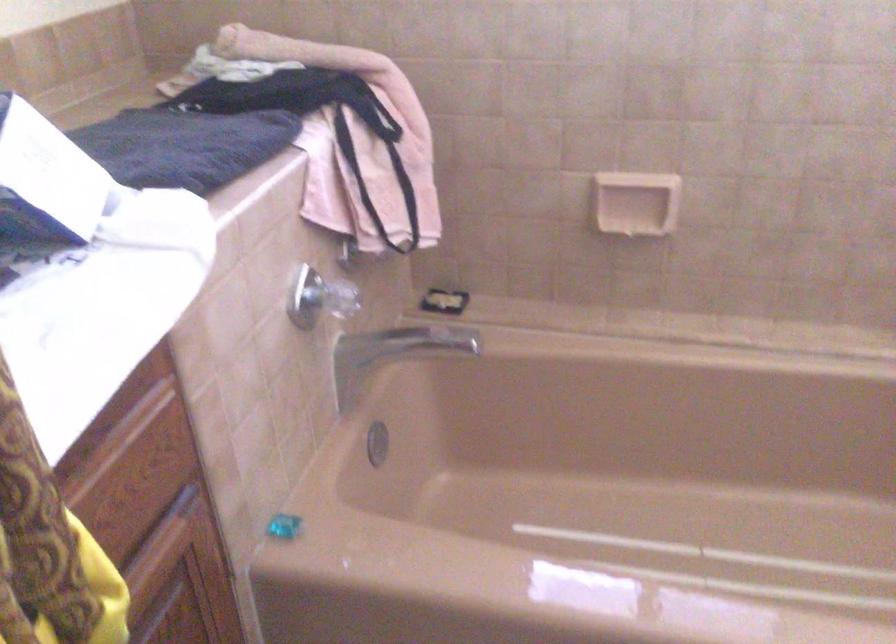
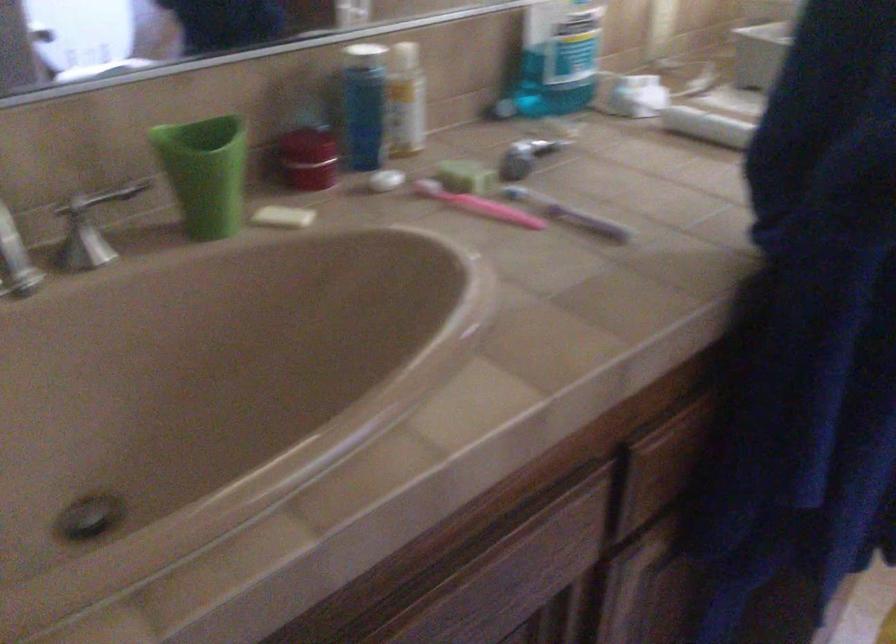
Question: The camera is either moving clockwise (left) or counter-clockwise (right) around the object. The first image is from the beginning of the video and the second image is from the end. Is the camera moving left or right when shooting the video?

Choices:
 (A) Left
 (B) Right

Answer: (B)